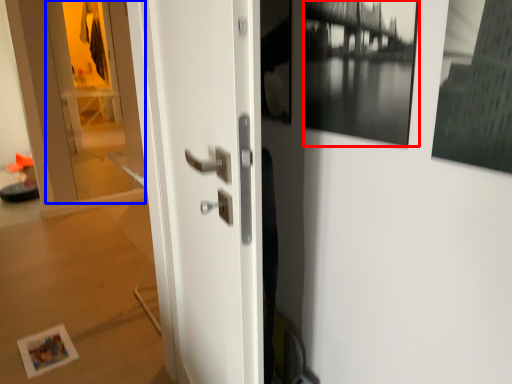
Question: Among these objects, which one is nearest to the camera, picture frame (highlighted by a red box) or glass door (highlighted by a blue box)?

Choices:
 (A) picture frame
 (B) glass door

Answer: (A)